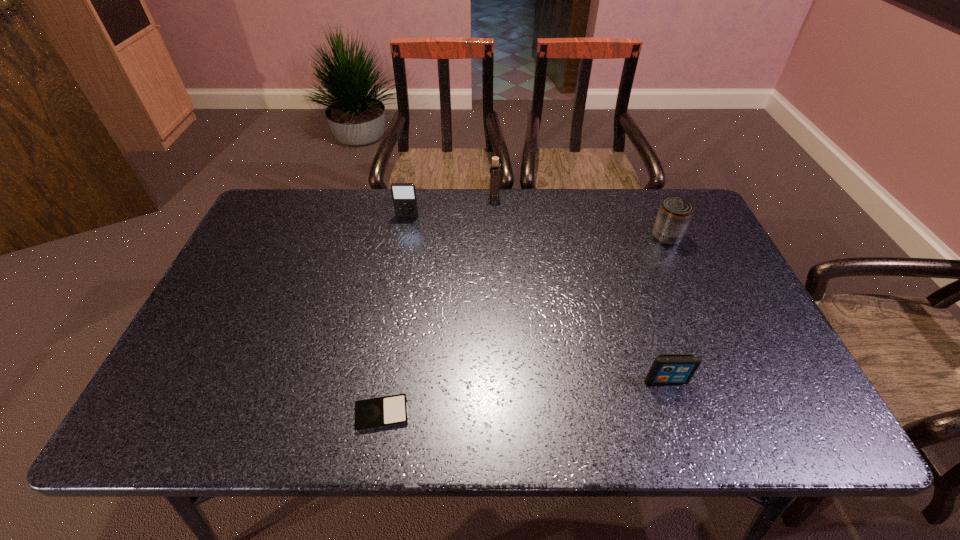
I want to click on free space located on the front of the farthest object, so click(x=495, y=229).

You are a GUI agent. You are given a task and a screenshot of the screen. Output one action in this format:
    pyautogui.click(x=<x>, y=<y>)
    Task: Click on the free location located on the front-facing side of the farthest iPod
    This screenshot has height=540, width=960.
    Given the screenshot: What is the action you would take?
    pyautogui.click(x=395, y=285)

This screenshot has height=540, width=960. In order to click on free space located 0.070m on the back of the third farthest object in this screenshot , I will do `click(656, 213)`.

At what (x,y) coordinates should I click in order to perform the action: click on free space located 0.050m on the front screen of the second nearest object. Please return your answer as a coordinate pair (x, y). Looking at the image, I should click on (674, 406).

You are a GUI agent. You are given a task and a screenshot of the screen. Output one action in this format:
    pyautogui.click(x=<x>, y=<y>)
    Task: Click on the vacant space situated on the left of the nearest iPod
    The width and height of the screenshot is (960, 540).
    Given the screenshot: What is the action you would take?
    pyautogui.click(x=179, y=414)

The width and height of the screenshot is (960, 540). Find the location of `candle holder present at the far edge`. candle holder present at the far edge is located at coordinates (494, 195).

I want to click on iPod located in the far edge section of the desktop, so click(404, 196).

You are a GUI agent. You are given a task and a screenshot of the screen. Output one action in this format:
    pyautogui.click(x=<x>, y=<y>)
    Task: Click on the can positioned at the far edge
    The width and height of the screenshot is (960, 540).
    Given the screenshot: What is the action you would take?
    pyautogui.click(x=674, y=216)

Identify the location of object that is at the near edge. The height and width of the screenshot is (540, 960). (387, 411).

Locate an element on the screen. object that is at the right edge is located at coordinates pyautogui.click(x=674, y=216).